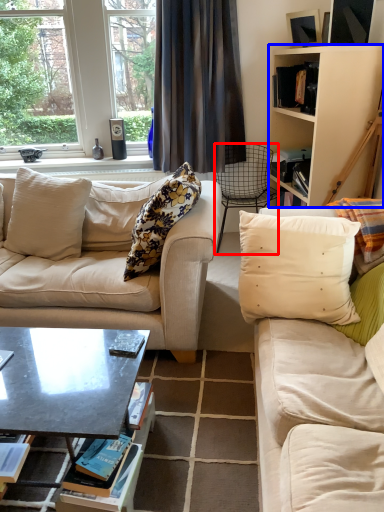
Question: Which of the following is the closest to the observer, chair (highlighted by a red box) or cabinetry (highlighted by a blue box)?

Choices:
 (A) chair
 (B) cabinetry

Answer: (B)